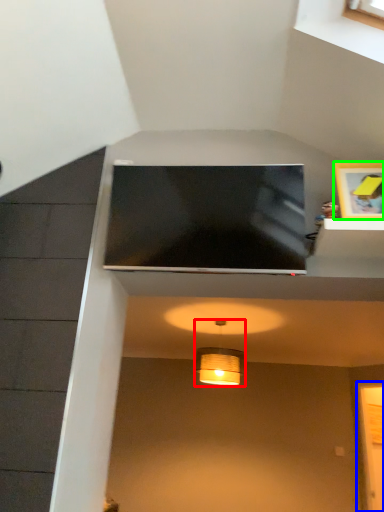
Question: Estimate the real-world distances between objects in this image. Which object is farther from lamp (highlighted by a red box), glass door (highlighted by a blue box) or picture frame (highlighted by a green box)?

Choices:
 (A) glass door
 (B) picture frame

Answer: (B)